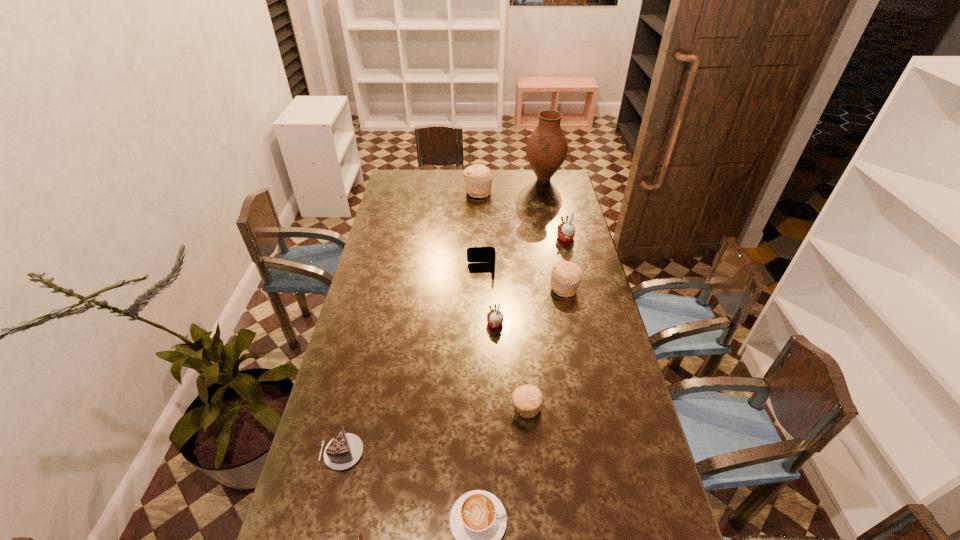
The width and height of the screenshot is (960, 540). What are the coordinates of `the nearest muffin` in the screenshot? It's located at (527, 399).

At what (x,y) coordinates should I click in order to perform the action: click on wallet. Please return your answer as a coordinate pair (x, y). Looking at the image, I should click on (474, 254).

Find the location of `the third nearest object`. the third nearest object is located at coordinates (345, 449).

The image size is (960, 540). I want to click on vacant space situated 0.080m on the left of the vase, so click(509, 179).

The height and width of the screenshot is (540, 960). Find the location of `free spot located 0.240m on the left of the second tallest object`. free spot located 0.240m on the left of the second tallest object is located at coordinates (416, 192).

Where is `free spot located on the front-facing side of the farther pink muffin`? The image size is (960, 540). free spot located on the front-facing side of the farther pink muffin is located at coordinates (491, 238).

Find the location of a particular element. This screenshot has width=960, height=540. vacant space situated 0.070m on the front-facing side of the farther pink muffin is located at coordinates pyautogui.click(x=540, y=238).

This screenshot has width=960, height=540. Identify the location of free space located 0.260m on the front-facing side of the farther pink muffin. (497, 238).

This screenshot has width=960, height=540. In order to click on free region located on the left of the rightmost beige muffin in this screenshot , I will do `click(516, 288)`.

Where is `vacant space located 0.330m on the front-facing side of the smaller pink muffin`? vacant space located 0.330m on the front-facing side of the smaller pink muffin is located at coordinates (394, 324).